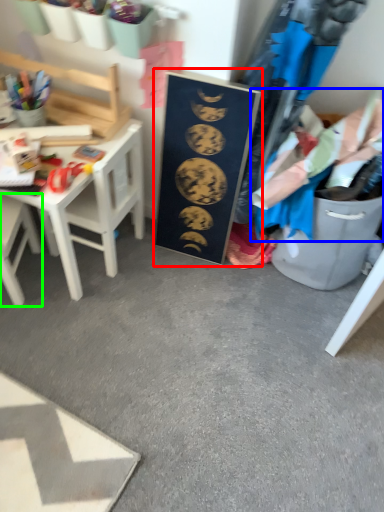
Question: Which is farther away from bulletin board (highlighted by a red box)? clothing (highlighted by a blue box) or chair (highlighted by a green box)?

Choices:
 (A) clothing
 (B) chair

Answer: (B)